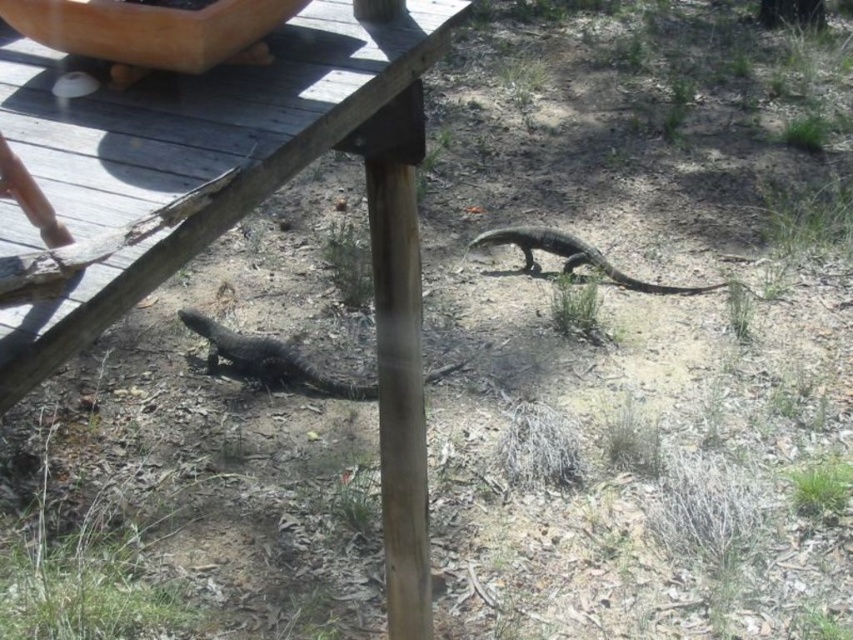
You are a photographer aiming to capture both shiny black lizard at lower left and shiny black lizard at center in your shot. Since you want to ensure both are fully visible, which lizard requires you to adjust your focus to a closer distance due to its size?

The shiny black lizard at lower left has a lesser height compared to the shiny black lizard at center, so you need to focus closer on the shiny black lizard at lower left to ensure it is fully visible in the photo.

You are standing at the center of the frame and want to locate the shiny black lizard at lower left. According to the coordinates provided, in which direction should you look to find it?

The shiny black lizard at lower left is located at point (267, 358), which is to the lower left direction from the center of the frame.